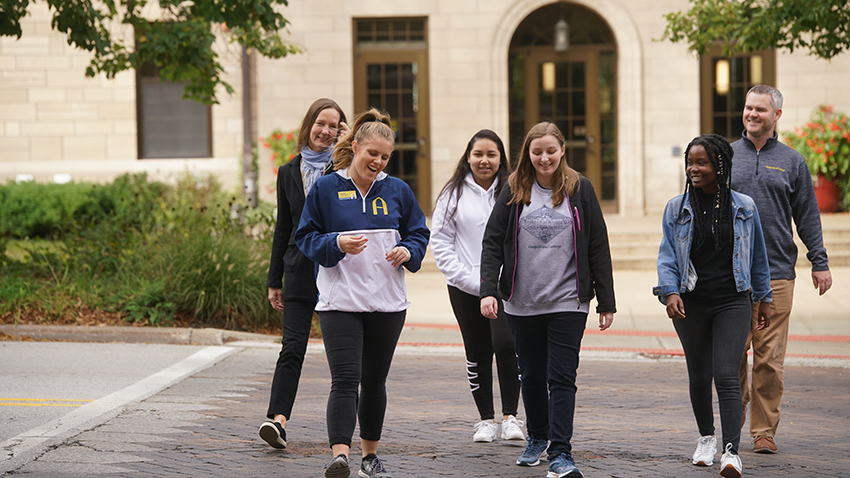
I want to click on coat, so click(582, 188).